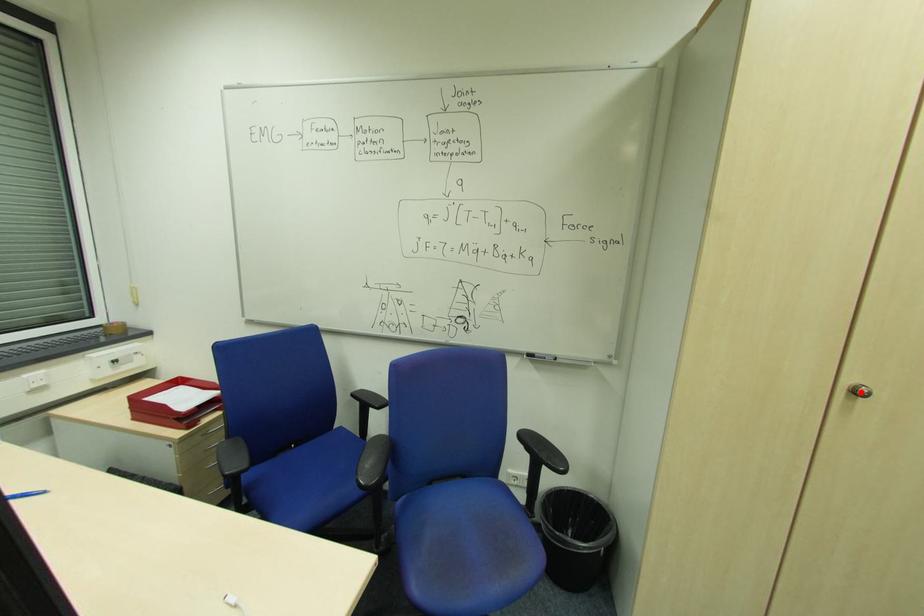
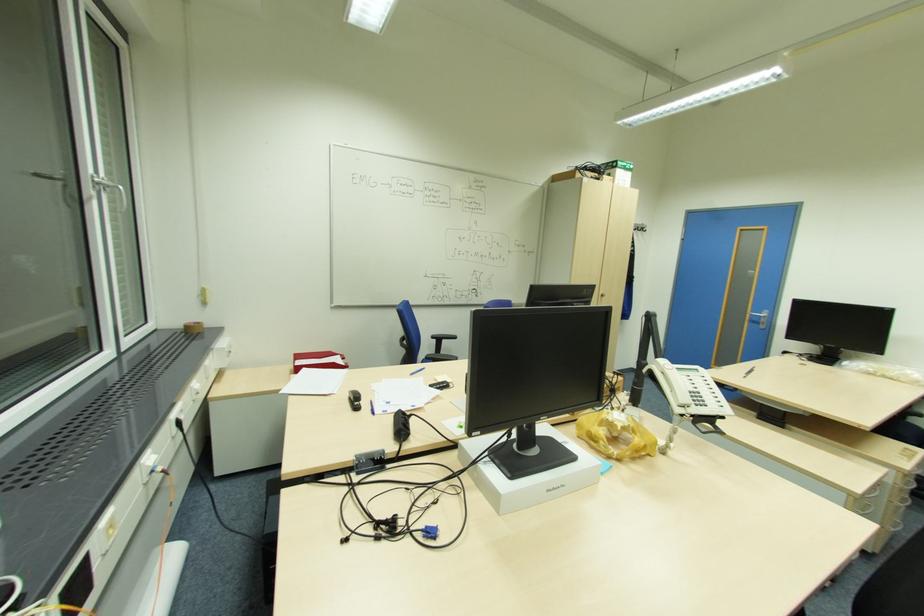
Question: I am providing you with two images of the same scene from different viewpoints. A red point is marked on the first image. At the location where the point appears in image 1, is it still visible in image 2?

Choices:
 (A) Yes
 (B) No

Answer: (A)